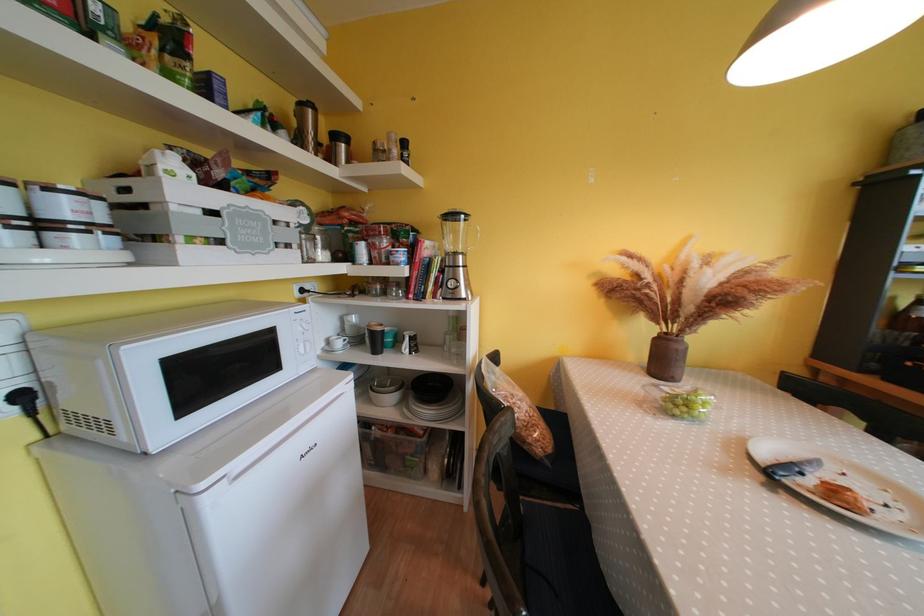
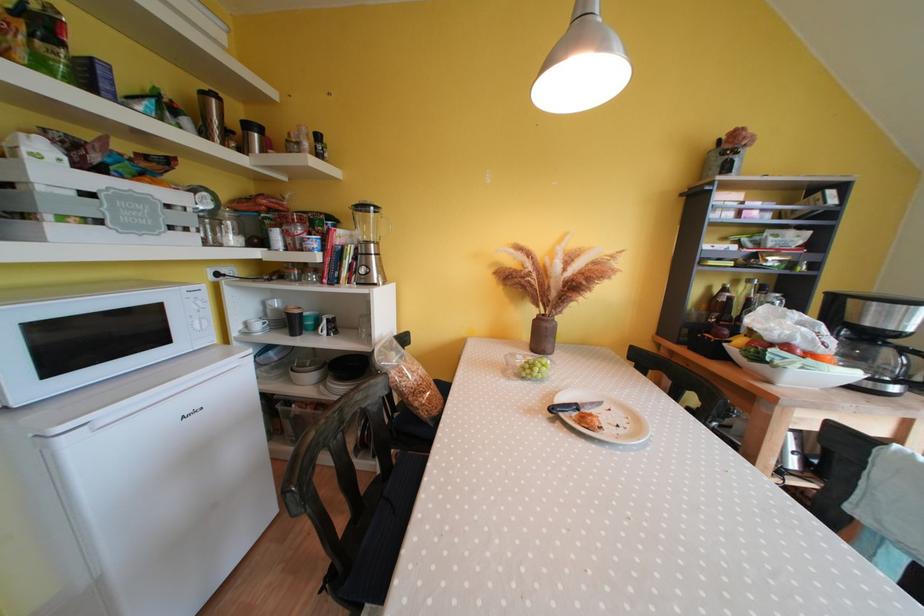
In the second image, find the point that corresponds to [379,337] in the first image.

(296, 318)